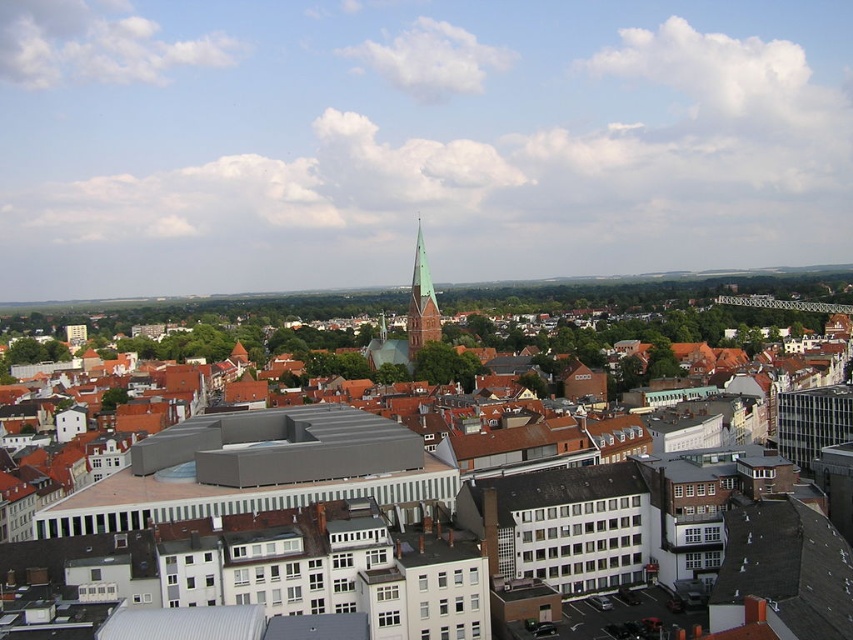
Which is behind, point (775, 468) or point (412, 266)?

Positioned behind is point (412, 266).

Image resolution: width=853 pixels, height=640 pixels. Identify the location of white matte building at center. (260, 472).